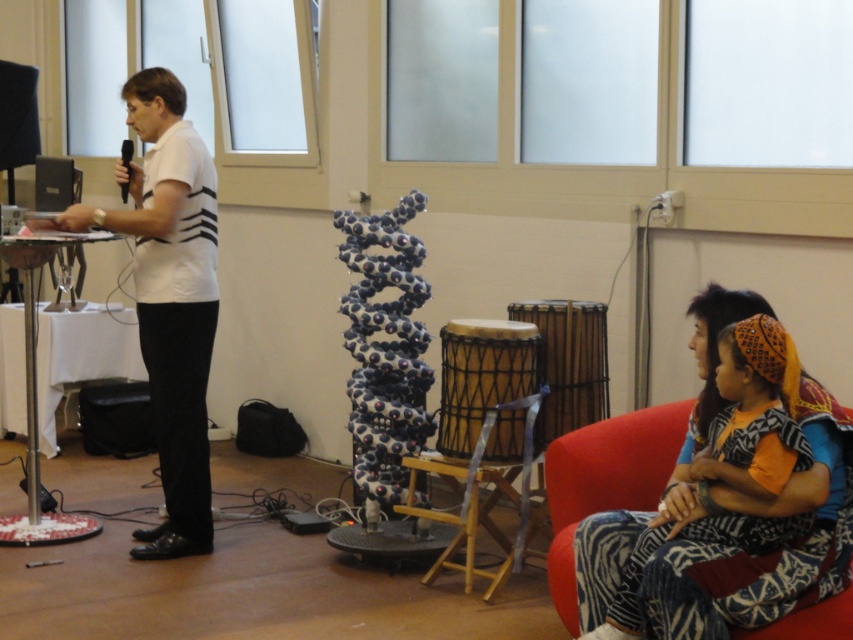
Question: Is white matte shirt at center bigger than black plastic microphone at upper left?

Choices:
 (A) no
 (B) yes

Answer: (B)

Question: Is white matte shirt at center wider than velvet fabric armchair at lower right?

Choices:
 (A) yes
 (B) no

Answer: (A)

Question: Which object appears farthest from the camera in this image?

Choices:
 (A) black plastic microphone at upper left
 (B) velvet fabric armchair at lower right
 (C) white matte shirt at center

Answer: (A)

Question: In this image, where is white matte shirt at center located relative to black plastic microphone at upper left?

Choices:
 (A) left
 (B) right

Answer: (B)

Question: Which object is positioned closest to the black plastic microphone at upper left?

Choices:
 (A) white matte shirt at center
 (B) velvet fabric armchair at lower right

Answer: (A)

Question: Among these objects, which one is farthest from the camera?

Choices:
 (A) velvet fabric armchair at lower right
 (B) white matte shirt at center
 (C) black plastic microphone at upper left

Answer: (C)